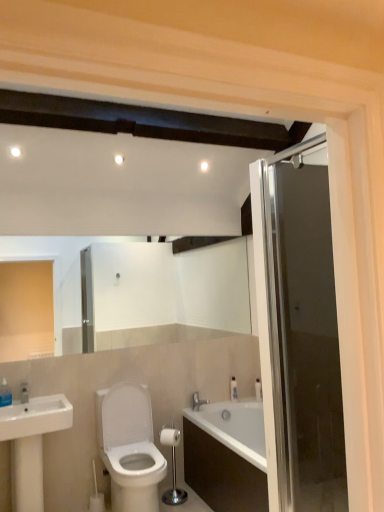
Question: In terms of height, does silver metallic faucet at lower center look taller or shorter compared to transparent glass door at right?

Choices:
 (A) short
 (B) tall

Answer: (A)

Question: Considering the relative positions of silver metallic faucet at lower center and transparent glass door at right in the image provided, is silver metallic faucet at lower center to the left or to the right of transparent glass door at right?

Choices:
 (A) left
 (B) right

Answer: (A)

Question: Which object is the farthest from the transparent glass door at right?

Choices:
 (A) silver metallic faucet at lower center
 (B) white plastic bottle at right
 (C) white matte toilet paper at center
 (D) silver metallic toilet paper holder at center
 (E) white glossy toilet at center

Answer: (A)

Question: Based on their relative distances, which object is nearer to the transparent glass door at right?

Choices:
 (A) silver metallic faucet at lower center
 (B) white plastic bottle at right
 (C) white glossy sink at left
 (D) white glossy toilet at center
 (E) silver metallic toilet paper holder at center

Answer: (D)